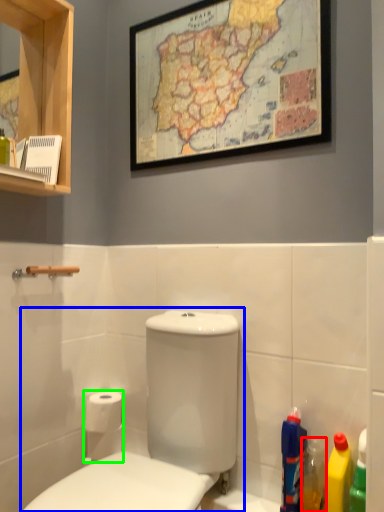
Question: Based on their relative distances, which object is farther from cleaning product (highlighted by a red box)? Choose from toilet (highlighted by a blue box) and toilet paper (highlighted by a green box).

Choices:
 (A) toilet
 (B) toilet paper

Answer: (B)